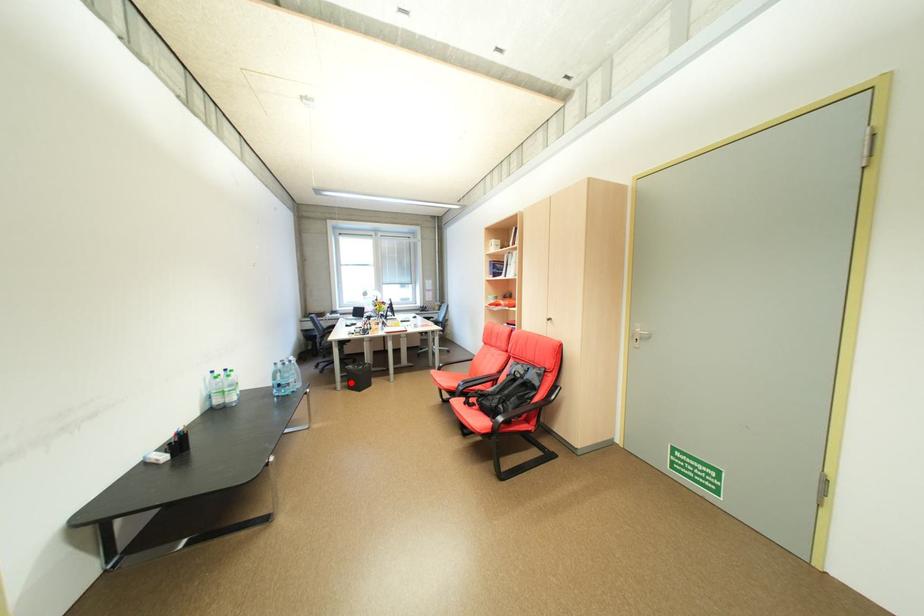
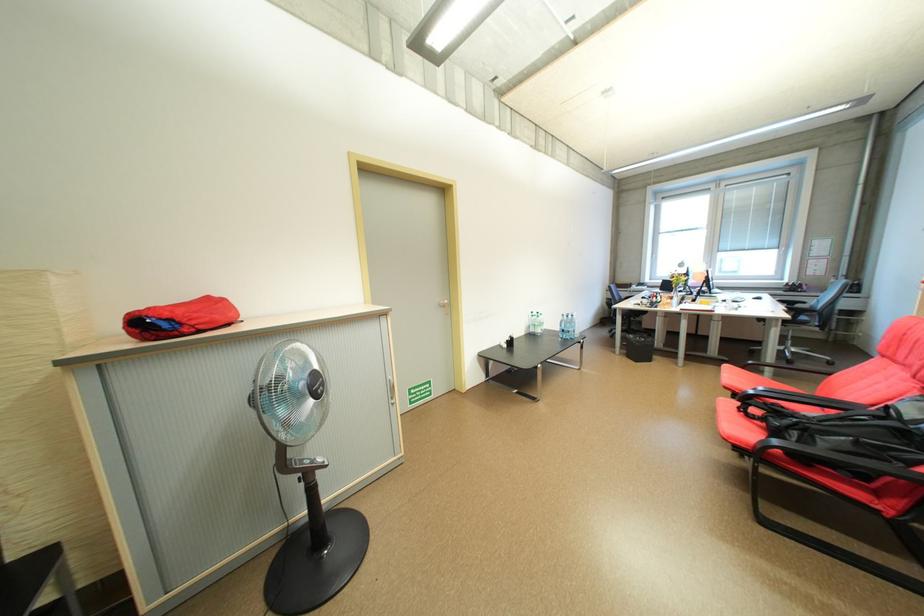
Question: I am providing you with two images of the same scene from different viewpoints. A red point is marked on the first image. Is the red point's position out of view in image 2?

Choices:
 (A) Yes
 (B) No

Answer: (B)